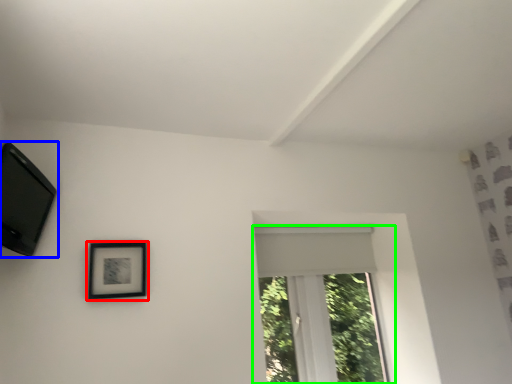
Question: Which object is the farthest from picture frame (highlighted by a red box)? Choose among these: picture frame (highlighted by a blue box) or window (highlighted by a green box).

Choices:
 (A) picture frame
 (B) window

Answer: (B)